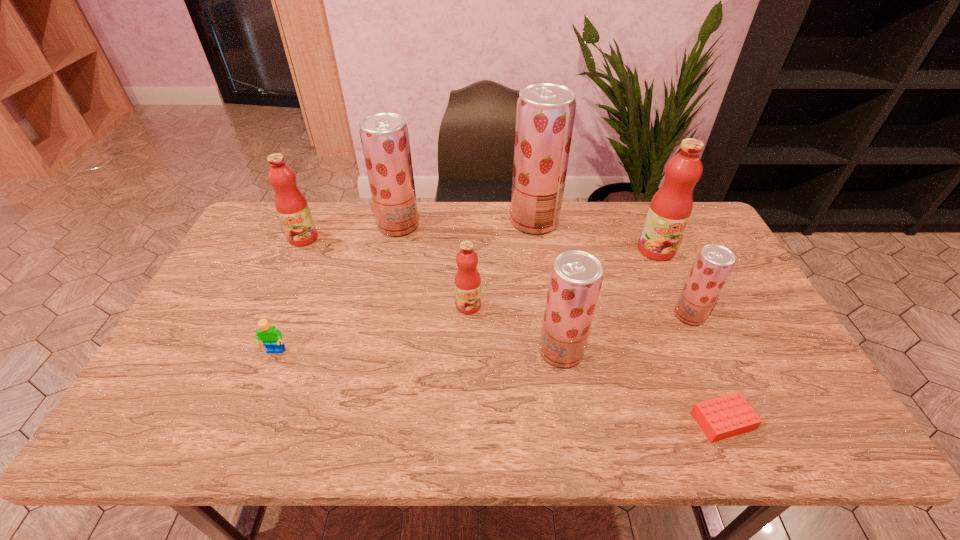
The height and width of the screenshot is (540, 960). I want to click on empty location between the rightmost strawberry fruit juice and the second fruit juice from left to right, so click(544, 270).

The width and height of the screenshot is (960, 540). In order to click on vacant area that lies between the eighth tallest object and the nearer Lego in this screenshot , I will do `click(499, 386)`.

Where is `free spot between the leftmost strawberry fruit juice and the taller Lego`? The width and height of the screenshot is (960, 540). free spot between the leftmost strawberry fruit juice and the taller Lego is located at coordinates (337, 288).

Select which object appears as the closest to the biggest pink fruit juice. Please provide its 2D coordinates. Your answer should be formatted as a tuple, i.e. [(x, y)], where the tuple contains the x and y coordinates of a point satisfying the conditions above.

[(714, 263)]

Locate which object ranks in proximity to the rightmost strawberry fruit juice. Please provide its 2D coordinates. Your answer should be formatted as a tuple, i.e. [(x, y)], where the tuple contains the x and y coordinates of a point satisfying the conditions above.

[(670, 208)]

At what (x,y) coordinates should I click in order to perform the action: click on fruit juice that is the fourth closest to the biggest pink fruit juice. Please return your answer as a coordinate pair (x, y). Looking at the image, I should click on (467, 279).

Where is `the third closest fruit juice relative to the biggest pink fruit juice`? the third closest fruit juice relative to the biggest pink fruit juice is located at coordinates (576, 276).

Where is `strawberry fruit juice that is the third closest to the biggest strawberry fruit juice`? strawberry fruit juice that is the third closest to the biggest strawberry fruit juice is located at coordinates (576, 276).

Where is `the closest strawberry fruit juice relative to the leftmost strawberry fruit juice`? The width and height of the screenshot is (960, 540). the closest strawberry fruit juice relative to the leftmost strawberry fruit juice is located at coordinates (545, 115).

At what (x,y) coordinates should I click in order to perform the action: click on pink fruit juice that is the nearest to the rightmost pink fruit juice. Please return your answer as a coordinate pair (x, y). The width and height of the screenshot is (960, 540). Looking at the image, I should click on (467, 279).